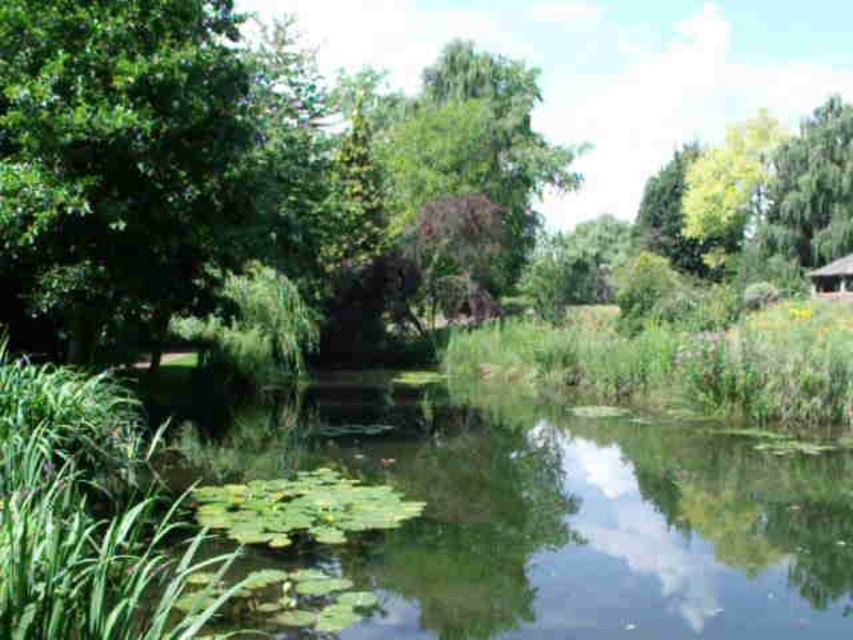
Can you confirm if green leafy tree at center is smaller than wooden hut at right?

Actually, green leafy tree at center might be larger than wooden hut at right.

Between green leafy tree at center and wooden hut at right, which one is positioned higher?

green leafy tree at center

Which is in front, point (798, 76) or point (846, 257)?

Point (846, 257) is in front.

Find the location of a particular element. The image size is (853, 640). green leafy tree at center is located at coordinates (120, 145).

This screenshot has height=640, width=853. I want to click on green leafy tree at center, so click(x=120, y=145).

Is green leafy tree at center closer to camera compared to green leafy tree at upper right?

Yes, green leafy tree at center is closer to the viewer.

What do you see at coordinates (120, 145) in the screenshot? I see `green leafy tree at center` at bounding box center [120, 145].

Where is `green leafy tree at center`? The image size is (853, 640). green leafy tree at center is located at coordinates (120, 145).

Is green leafy tree at upper right further to camera compared to wooden hut at right?

Yes, green leafy tree at upper right is further from the viewer.

Between green leafy tree at upper right and wooden hut at right, which one is positioned higher?

green leafy tree at upper right is above.

Is point (821, 125) positioned after point (824, 292)?

Yes.

This screenshot has height=640, width=853. Find the location of `green leafy tree at upper right`. green leafy tree at upper right is located at coordinates (810, 192).